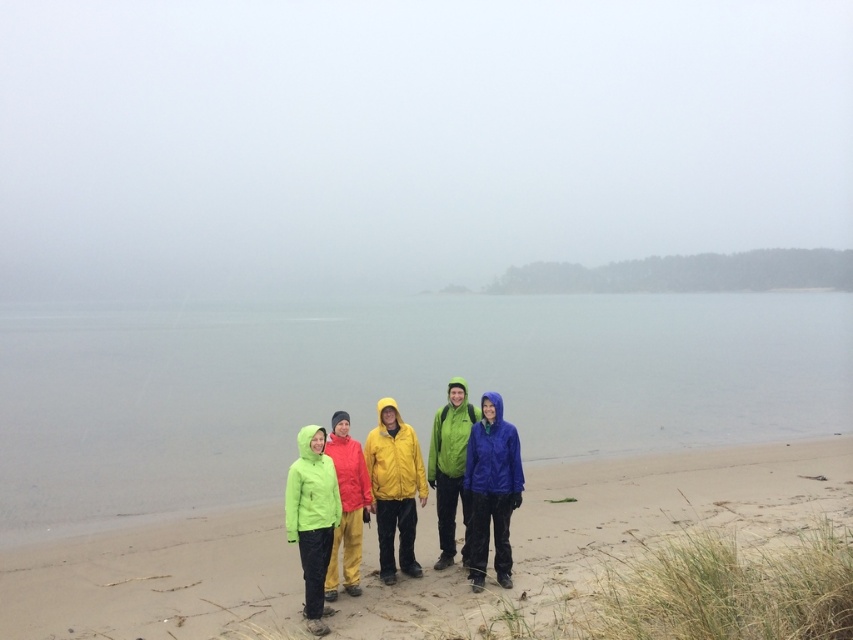
Question: Which point is farther to the camera?

Choices:
 (A) (141, 536)
 (B) (383, 522)
 (C) (291, 481)
 (D) (347, 435)

Answer: (A)

Question: Which point is farther to the camera?

Choices:
 (A) (350, 552)
 (B) (518, 486)
 (C) (467, 401)
 (D) (747, 490)

Answer: (D)

Question: Is clear water at center thinner than sandy beach at lower center?

Choices:
 (A) yes
 (B) no

Answer: (B)

Question: Based on their relative distances, which object is farther from the matte yellow raincoat at center?

Choices:
 (A) sandy beach at lower center
 (B) matte yellow jacket at center
 (C) neon green jacket at center
 (D) green matte jacket at center

Answer: (A)

Question: Can you confirm if clear water at center is positioned below neon green jacket at center?

Choices:
 (A) yes
 (B) no

Answer: (B)

Question: Can you confirm if matte yellow raincoat at center is positioned to the left of neon green jacket at center?

Choices:
 (A) no
 (B) yes

Answer: (A)